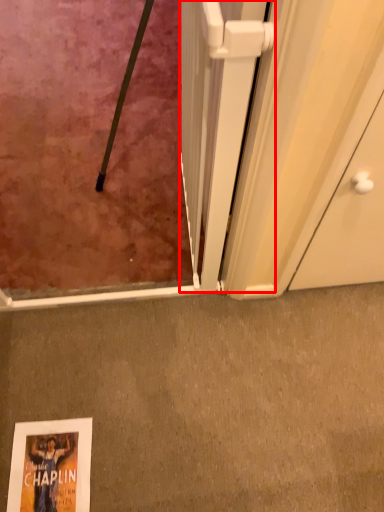
Question: From the image's perspective, considering the relative positions of screen door (annotated by the red box) and concrete in the image provided, where is screen door (annotated by the red box) located with respect to the staircase?

Choices:
 (A) above
 (B) below

Answer: (A)